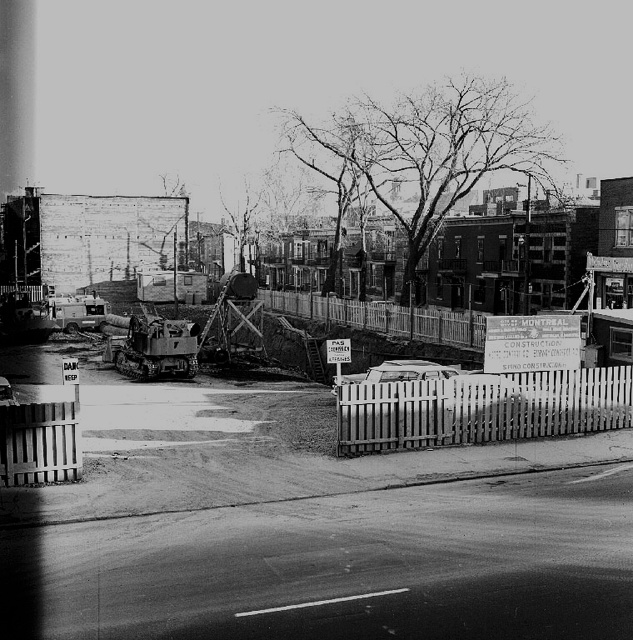
You are a delivery driver who needs to enter the construction site through the wooden picket fence at lower right or the white picket fence at center. Which fence is shorter and therefore easier to climb over?

The wooden picket fence at lower right has a lesser height compared to the white picket fence at center, so it is shorter and easier to climb over.

You are standing at the center of the image and want to walk towards the wooden picket fence at lower right. What direction should you move in?

The wooden picket fence at lower right is located at point (480, 408), so you should move towards the lower right direction to reach it.